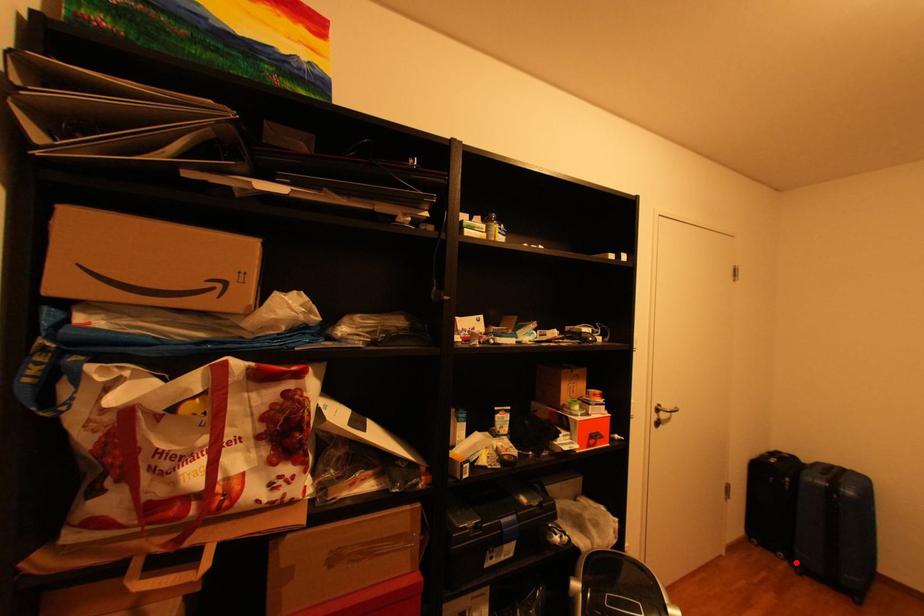
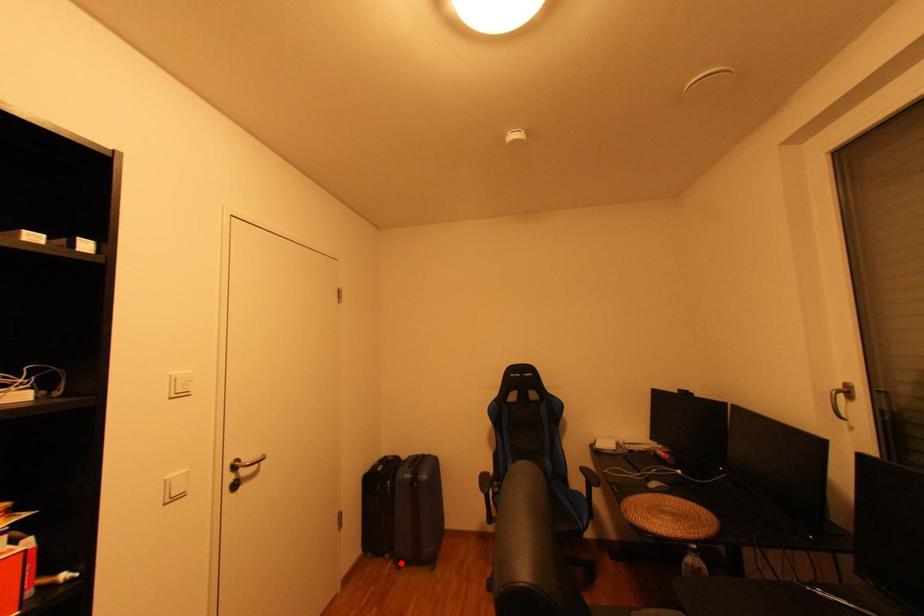
I am providing you with two images of the same scene from different viewpoints. A red point is marked on the first image and another point is marked on the second image. Does the point marked in image1 correspond to the same location as the one in image2?

Yes